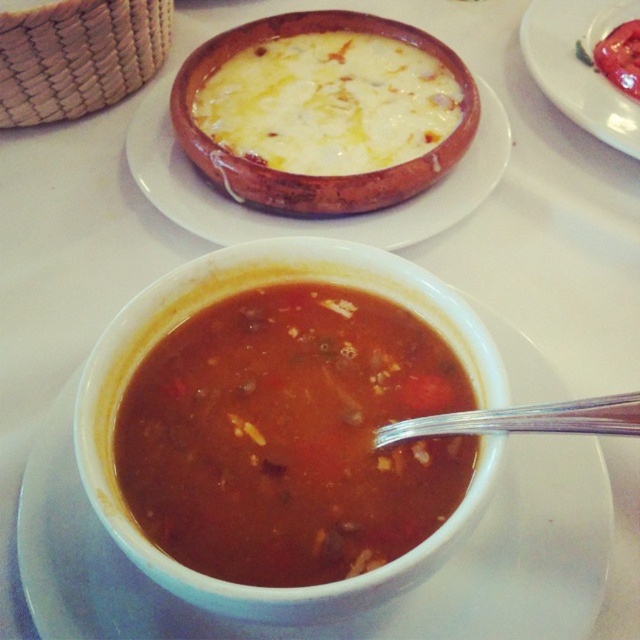
You are a food critic evaluating the dining setup. You notice a point marked at coordinates (328, 104). Which soup is this point located on?

The point at coordinates (328, 104) is located on the white creamy soup at upper center.

You are a chef preparing a meal and have two tomato dishes in front of you. You need to choose the wider dish to serve a large salad. Which one should you pick between the tomato matte at upper right and the tomato paste at upper right?

The tomato matte at upper right is wider than the tomato paste at upper right, so you should pick the tomato matte at upper right to serve the large salad.